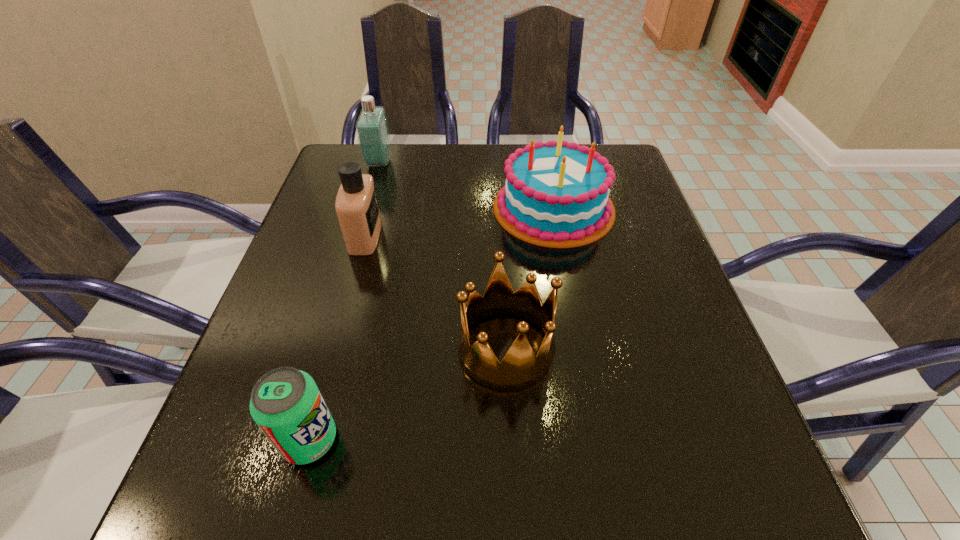
At what (x,y) coordinates should I click in order to perform the action: click on perfume present at the far edge. Please return your answer as a coordinate pair (x, y). The image size is (960, 540). Looking at the image, I should click on (372, 130).

Identify the location of birthday cake located at the far edge. (556, 193).

Where is `object positioned at the near edge`? object positioned at the near edge is located at coordinates (286, 404).

Locate an element on the screen. The width and height of the screenshot is (960, 540). pop soda that is at the left edge is located at coordinates (286, 404).

Where is `object that is at the right edge`? This screenshot has height=540, width=960. object that is at the right edge is located at coordinates (556, 193).

Where is `object located at the far left corner`? object located at the far left corner is located at coordinates click(x=372, y=130).

Identify the location of object that is at the near left corner. (286, 404).

Where is `object at the far right corner`? This screenshot has height=540, width=960. object at the far right corner is located at coordinates (556, 193).

In the image, there is a desktop. Identify the location of blank space at the far edge. (396, 158).

Locate an element on the screen. The width and height of the screenshot is (960, 540). vacant space at the near edge of the desktop is located at coordinates (535, 518).